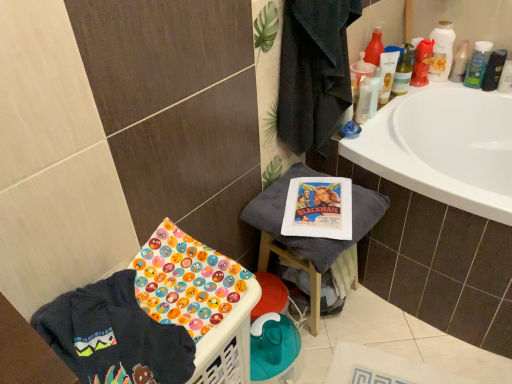
Question: From the image's perspective, is dark blue cotton t-shirt at lower left on top of translucent plastic mouthwash at upper right, the fifth mouthwash positioned from the right?

Choices:
 (A) no
 (B) yes

Answer: (A)

Question: Does dark blue cotton t-shirt at lower left lie behind translucent plastic mouthwash at upper right, the second mouthwash when ordered from left to right?

Choices:
 (A) yes
 (B) no

Answer: (B)

Question: Is dark blue cotton t-shirt at lower left at the right side of translucent plastic mouthwash at upper right, the fifth mouthwash positioned from the right?

Choices:
 (A) yes
 (B) no

Answer: (B)

Question: Can you confirm if dark blue cotton t-shirt at lower left is positioned to the left of translucent plastic mouthwash at upper right, the fifth mouthwash positioned from the right?

Choices:
 (A) yes
 (B) no

Answer: (A)

Question: Can we say dark blue cotton t-shirt at lower left lies outside translucent plastic mouthwash at upper right, the fifth mouthwash positioned from the right?

Choices:
 (A) no
 (B) yes

Answer: (B)

Question: Is there a large distance between dark blue cotton t-shirt at lower left and translucent plastic mouthwash at upper right, the fifth mouthwash positioned from the right?

Choices:
 (A) no
 (B) yes

Answer: (B)

Question: Would you consider black matte bottle at upper right, placed as the 1th mouthwash when sorted from right to left, to be distant from translucent plastic bottle at upper right?

Choices:
 (A) yes
 (B) no

Answer: (B)

Question: Can translucent plastic bottle at upper right be found inside black matte bottle at upper right, placed as the 1th mouthwash when sorted from right to left?

Choices:
 (A) no
 (B) yes

Answer: (A)

Question: From a real-world perspective, is black matte bottle at upper right, placed as the 1th mouthwash when sorted from right to left, on translucent plastic bottle at upper right?

Choices:
 (A) no
 (B) yes

Answer: (A)

Question: Is black matte bottle at upper right, the 6th mouthwash viewed from the left, at the right side of translucent plastic bottle at upper right?

Choices:
 (A) yes
 (B) no

Answer: (A)

Question: Is black matte bottle at upper right, placed as the 1th mouthwash when sorted from right to left, looking in the opposite direction of translucent plastic bottle at upper right?

Choices:
 (A) yes
 (B) no

Answer: (B)

Question: Considering the relative sizes of black matte bottle at upper right, placed as the 1th mouthwash when sorted from right to left, and translucent plastic bottle at upper right in the image provided, is black matte bottle at upper right, placed as the 1th mouthwash when sorted from right to left, smaller than translucent plastic bottle at upper right?

Choices:
 (A) yes
 (B) no

Answer: (B)

Question: Is green plastic mouthwash at upper right, the 2th mouthwash viewed from the right, far from white plastic mouthwash at upper right, the sixth mouthwash from the right?

Choices:
 (A) yes
 (B) no

Answer: (B)